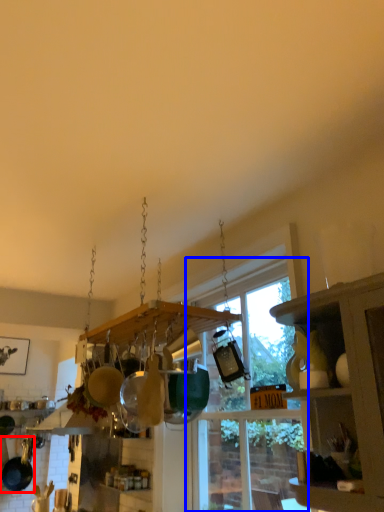
Question: Which point is further to the camera, frying pan (highlighted by a red box) or window (highlighted by a blue box)?

Choices:
 (A) frying pan
 (B) window

Answer: (A)